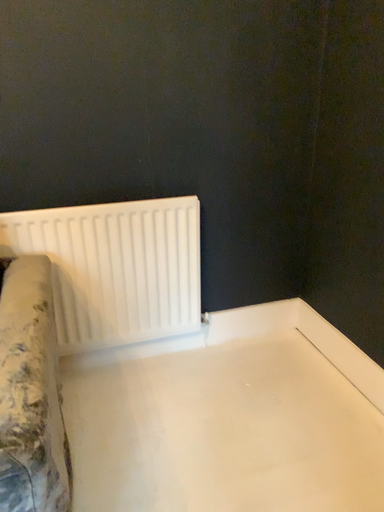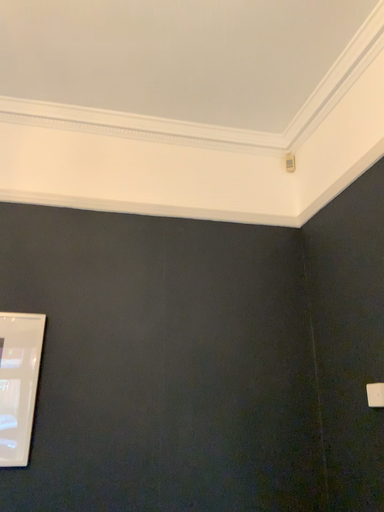
Question: Which way did the camera rotate in the video?

Choices:
 (A) rotated downward
 (B) rotated upward

Answer: (B)